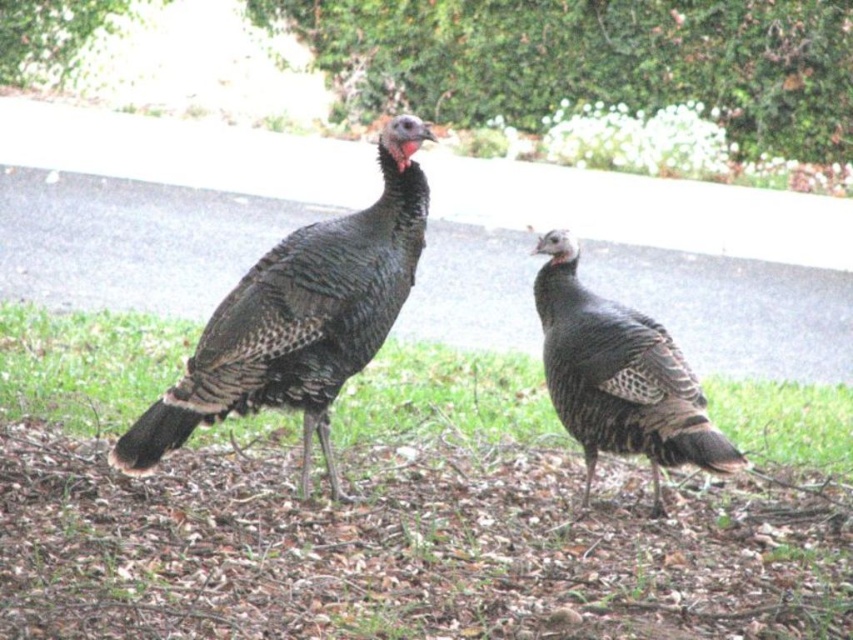
You are standing at the point marked as point (86, 364). What is located at this point?

The point (86, 364) is where the green grass at center is located.

You are a photographer trying to capture a clear photo of the speckled feathered turkey at center. However, the green grass at center is blocking your view. Can you adjust your position to see the turkey without the grass obstructing the view?

The speckled feathered turkey at center is behind green grass at center, so moving your position to get a better angle might allow you to see the turkey without the grass blocking the view.

You are a birdwatcher observing the scene. You notice the green grass at center and the speckled feathered turkey at center. Which object is located to the right side of the other?

The green grass at center is positioned on the left side of the speckled feathered turkey at center, so the speckled feathered turkey at center is to the right of the green grass at center.